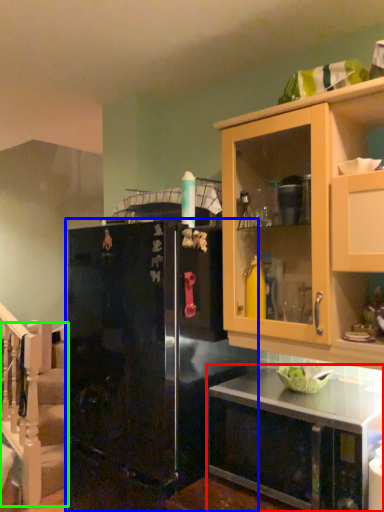
Question: Estimate the real-world distances between objects in this image. Which object is farther from countertop (highlighted by a red box), refrigerator (highlighted by a blue box) or stairwell (highlighted by a green box)?

Choices:
 (A) refrigerator
 (B) stairwell

Answer: (B)